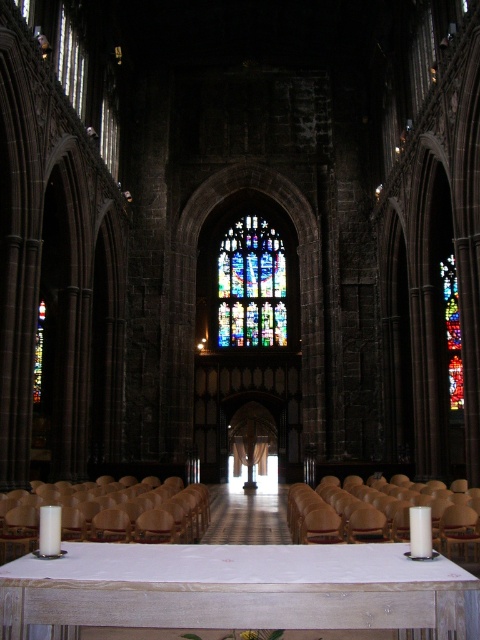
From the picture: You are standing in the cathedral and want to place a bouquet of flowers on the white wood table at lower center. However, you notice that the multicolored stained glass at right is directly above the table. Will the flowers be in the sunlight coming through the stained glass?

The white wood table at lower center is to the left of the multicolored stained glass at right, so the table is positioned to the side of the stained glass. Therefore, the sunlight from the stained glass will not directly shine on the flowers placed on the table.

From the picture: You are a visitor in the cathedral and want to place the white matte candle at center on the brown wood chair at lower center. Can the candle fit on the chair?

The brown wood chair at lower center might be wider than white matte candle at center, so there is a possibility that the candle can fit on the chair.